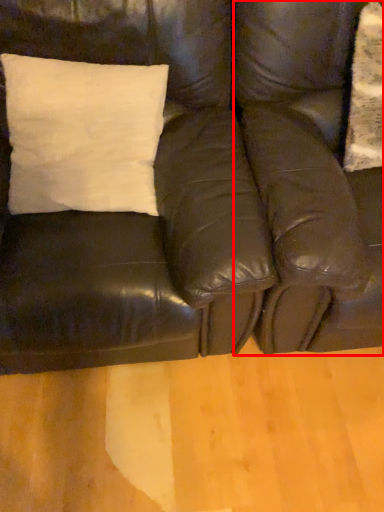
Question: From the image's perspective, what is the correct spatial positioning of swivel chair (annotated by the red box) in reference to studio couch?

Choices:
 (A) above
 (B) below

Answer: (A)